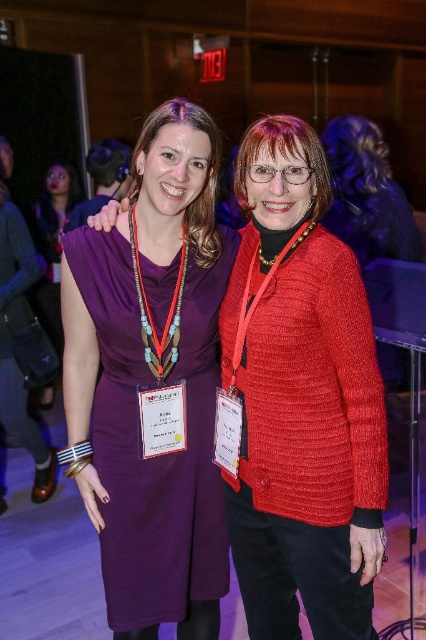
Can you confirm if knitted red sweater at center is positioned below matte purple dress at center?

Yes, knitted red sweater at center is below matte purple dress at center.

Describe the element at coordinates (299, 401) in the screenshot. I see `knitted red sweater at center` at that location.

This screenshot has height=640, width=426. Identify the location of knitted red sweater at center. (299, 401).